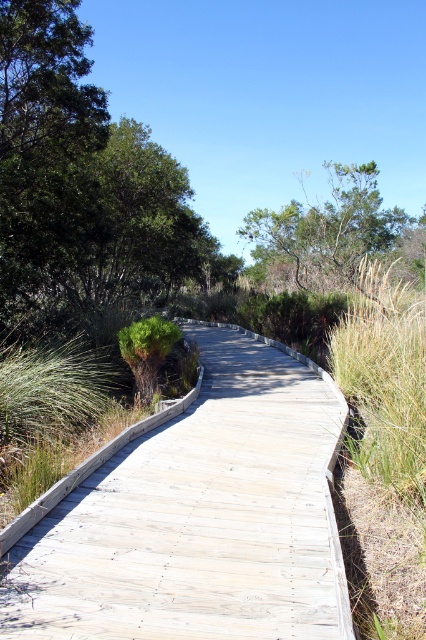
Question: Does light gray wooden boardwalk at center appear on the right side of green leafy tree at upper left?

Choices:
 (A) no
 (B) yes

Answer: (B)

Question: Does light gray wooden boardwalk at center appear on the right side of green leafy tree at upper left?

Choices:
 (A) yes
 (B) no

Answer: (A)

Question: Can you confirm if light gray wooden boardwalk at center is bigger than green leafy tree at upper left?

Choices:
 (A) no
 (B) yes

Answer: (A)

Question: Which of the following is the farthest from the observer?

Choices:
 (A) green leafy tree at upper left
 (B) light gray wooden boardwalk at center

Answer: (A)

Question: Which of the following is the farthest from the observer?

Choices:
 (A) (39, 102)
 (B) (264, 234)
 (C) (74, 602)

Answer: (B)

Question: Which of the following is the closest to the observer?

Choices:
 (A) click(x=261, y=234)
 (B) click(x=17, y=292)

Answer: (B)